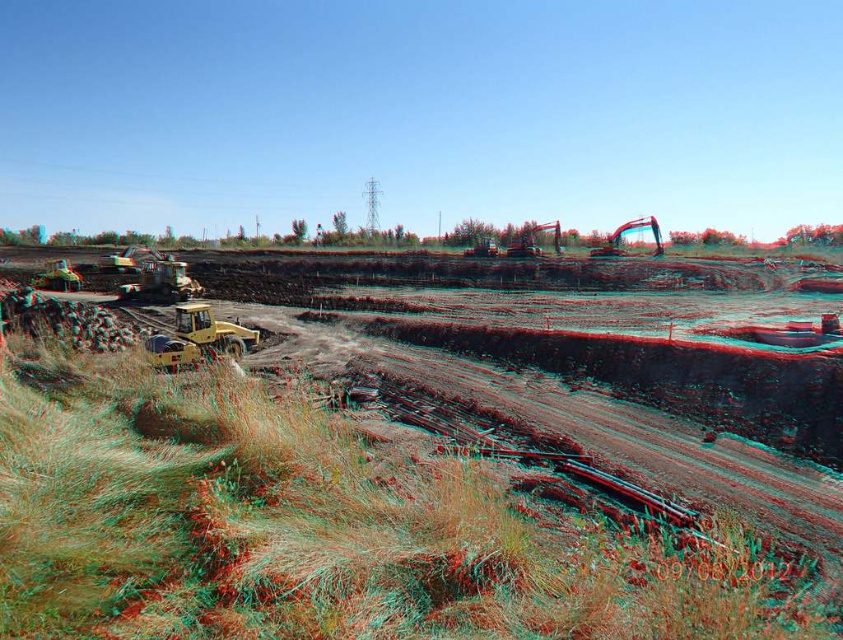
You are a safety inspector at the construction site. You need to place a safety barrier that is 3 meters wide between the yellow rubber at center and the yellow rubber excavator at lower left. Is there enough space to place the barrier between them?

The yellow rubber at center might be wider than yellow rubber excavator at lower left, but the exact width difference is not specified. Without knowing the exact widths, it is uncertain if the 3 meter barrier can fit between them.